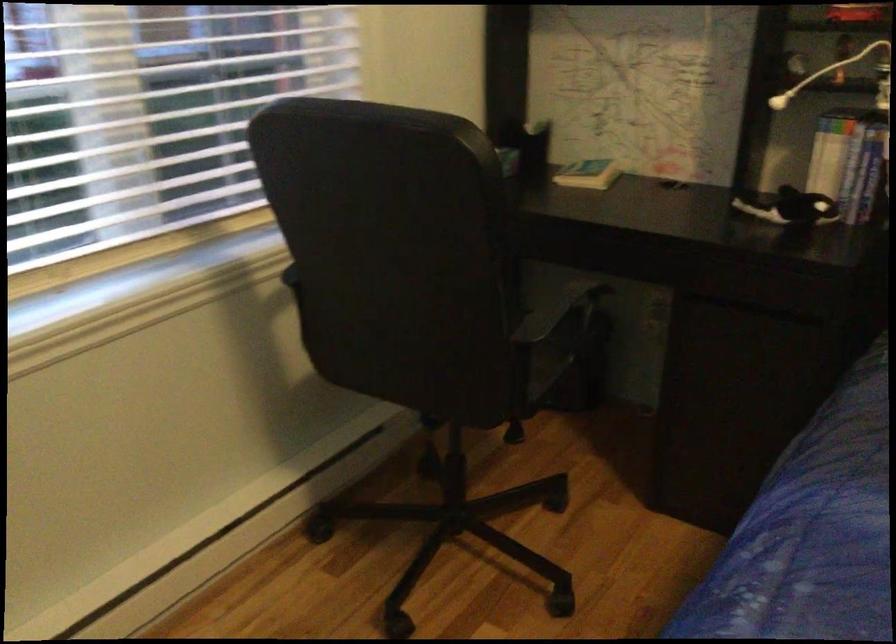
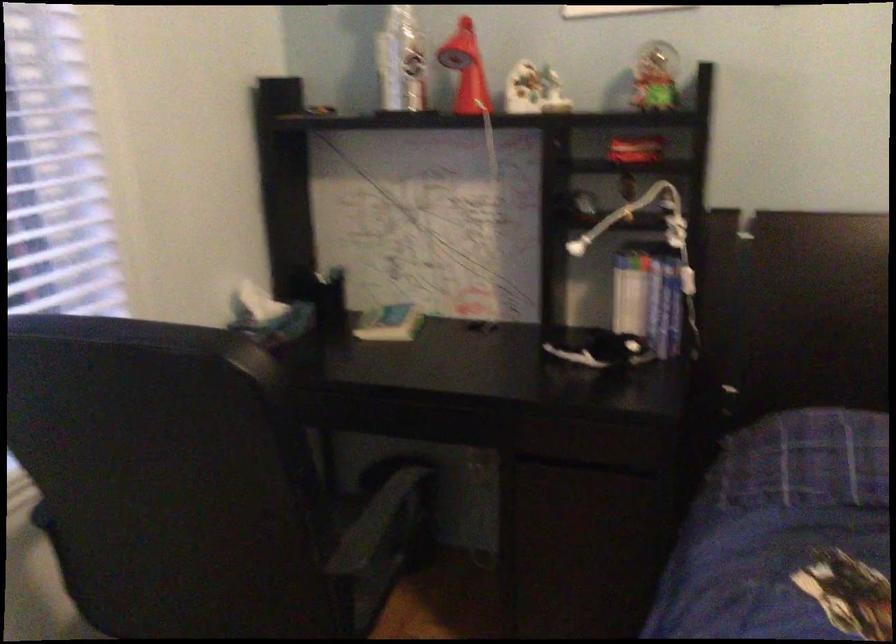
Question: Based on the continuous images, in which direction is the camera rotating? Reply with the corresponding letter.

Choices:
 (A) Left
 (B) Right
 (C) Up
 (D) Down

Answer: (B)